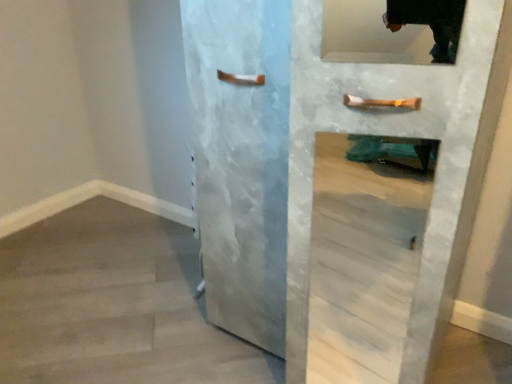
Where is `vacant region below matte white cabinet at center (from a real-world perspective)`? vacant region below matte white cabinet at center (from a real-world perspective) is located at coordinates (320, 345).